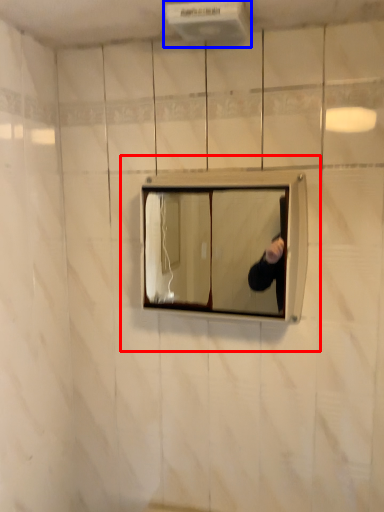
Question: Which object appears farthest to the camera in this image, medicine cabinet (highlighted by a red box) or air conditioner (highlighted by a blue box)?

Choices:
 (A) medicine cabinet
 (B) air conditioner

Answer: (A)